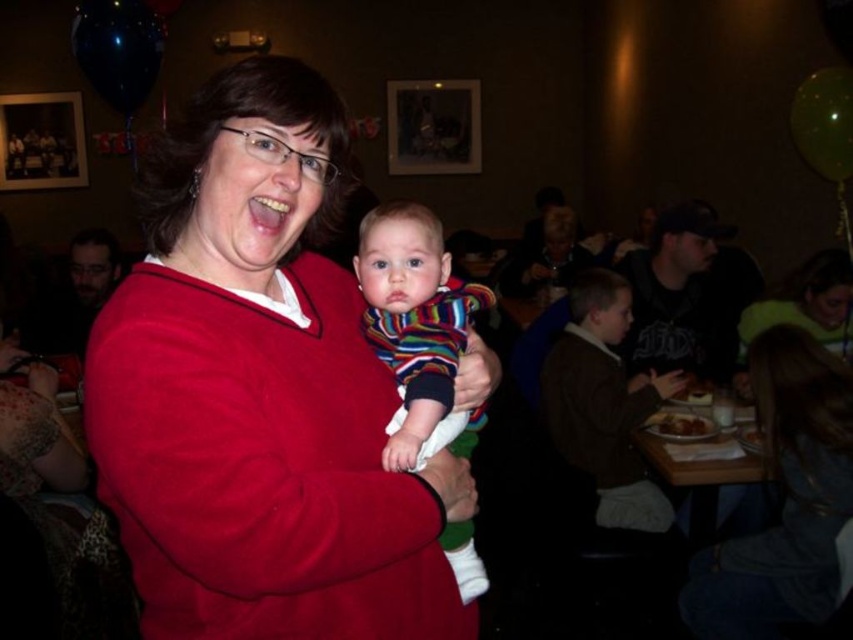
Does point (235, 499) come farther from viewer compared to point (415, 273)?

No, (235, 499) is closer to viewer.

Locate an element on the screen. This screenshot has width=853, height=640. matte red sweater at center is located at coordinates 260,392.